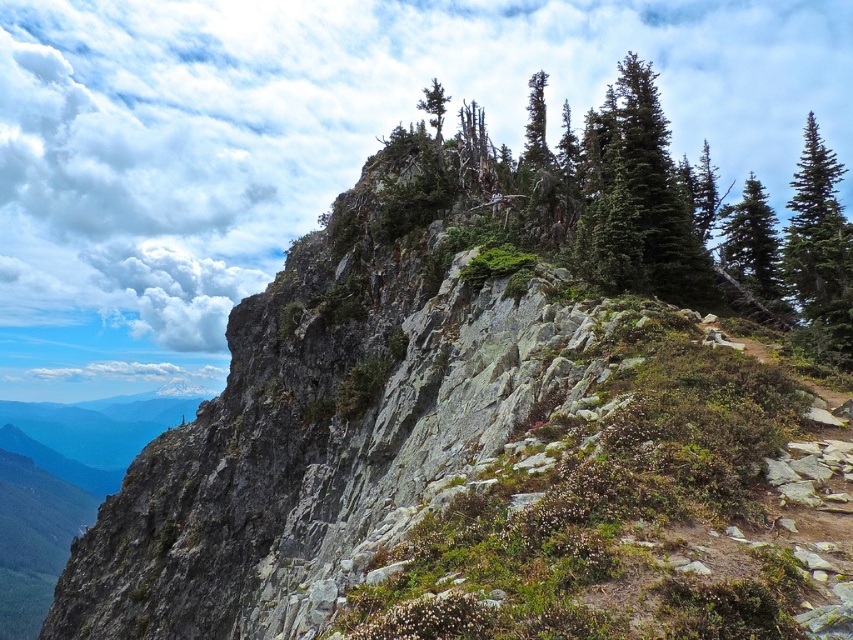
You are a hiker looking for the best route up the mountain. You notice two trees at the upper right corner of your view. Which tree, the green textured pine tree at upper right or the green matte tree at upper right, is positioned higher up the slope?

The green textured pine tree at upper right is positioned higher up the slope than the green matte tree at upper right because it is located above it according to the description.

You are a hiker trying to navigate the steep slope. You notice the green textured rock at upper center and the green textured pine tree at upper right. Which object is larger in size?

The green textured rock at upper center is bigger than the green textured pine tree at upper right.

You are a hiker trying to navigate the steep slope. You notice a green textured rock at upper center and a green matte tree at upper center. Which object is easier to reach if you want to grab something for support?

The green textured rock at upper center is closer to the viewer than the green matte tree at upper center, so it is easier to reach for support.